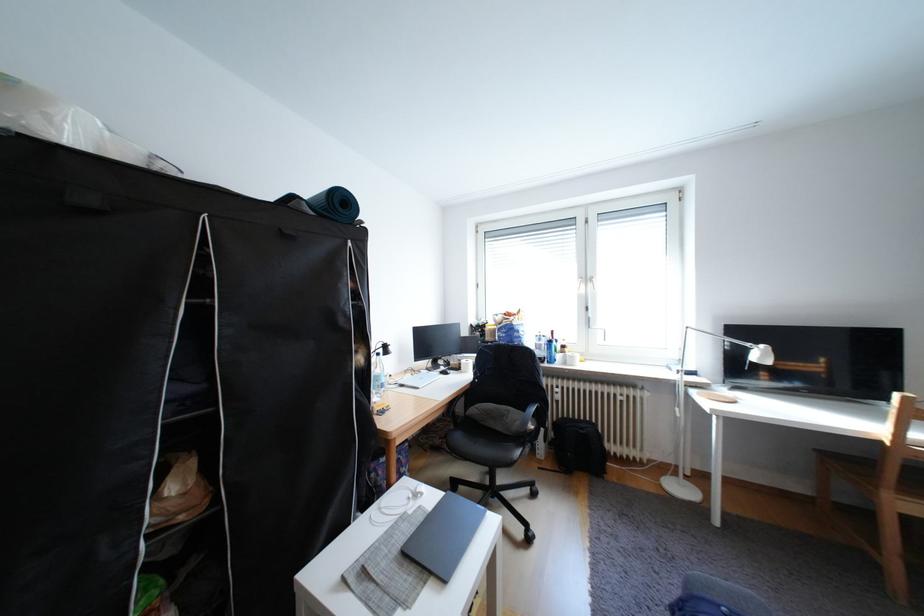
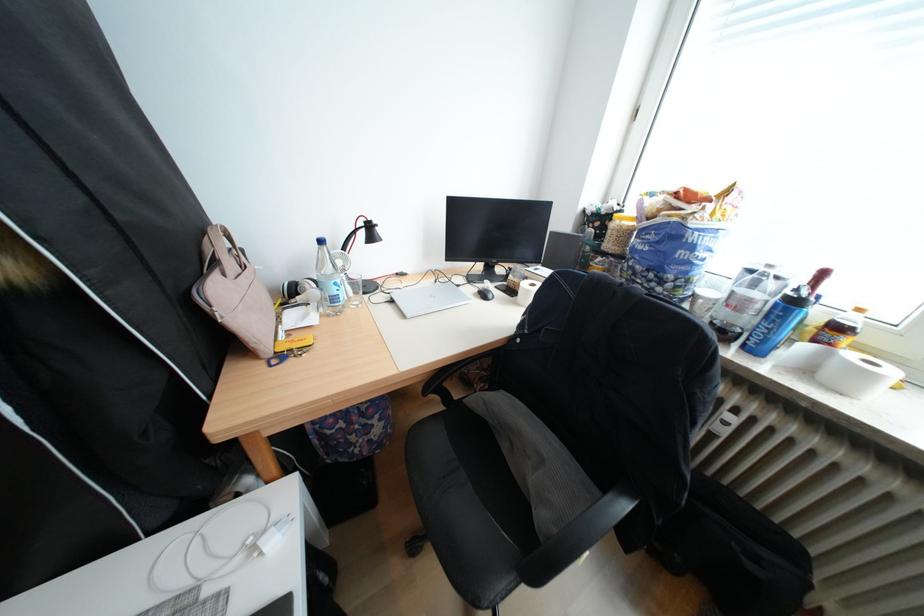
In the second image, find the point that corresponds to [594,430] in the first image.

(771, 561)